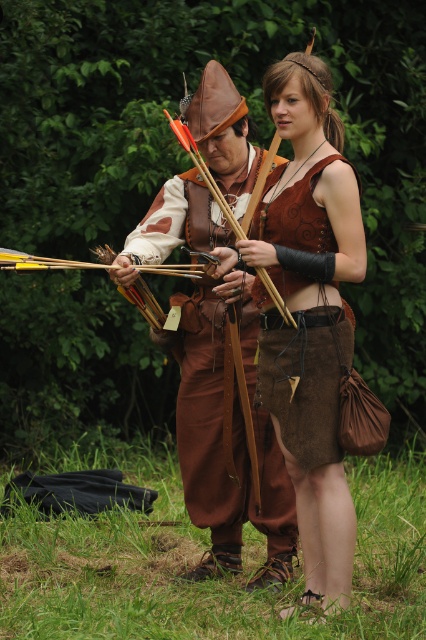
Does point (330, 205) come behind point (238, 224)?

No.

Can you confirm if brown leather bow at center is thinner than leather bow at center?

No, brown leather bow at center is not thinner than leather bow at center.

Is point (275, 476) more distant than point (282, 314)?

Yes, it is.

This screenshot has width=426, height=640. Find the location of `brown leather bow at center`. brown leather bow at center is located at coordinates (281, 333).

Who is higher up, brown leather bow at center or brown suede vest at center?

brown suede vest at center is higher up.

Can you confirm if brown leather bow at center is smaller than brown suede vest at center?

Actually, brown leather bow at center might be larger than brown suede vest at center.

At what (x,y) coordinates should I click in order to perform the action: click on brown leather bow at center. Please return your answer as a coordinate pair (x, y). This screenshot has height=640, width=426. Looking at the image, I should click on (281, 333).

Between brown suede vest at center and leather bow at center, which one appears on the right side from the viewer's perspective?

Positioned to the right is brown suede vest at center.

Which is more to the left, brown suede vest at center or leather bow at center?

Positioned to the left is leather bow at center.

Is point (294, 364) farther from viewer compared to point (186, 140)?

No.

Locate an element on the screen. brown suede vest at center is located at coordinates (302, 385).